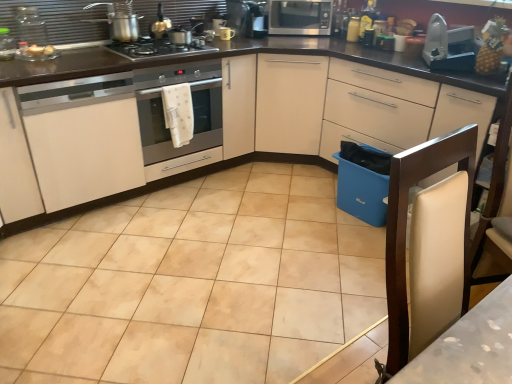
Question: Looking at the image, does beige ceramic tile at center seem bigger or smaller compared to metallic gray iron at upper right, which is the 1th appliance in right-to-left order?

Choices:
 (A) small
 (B) big

Answer: (B)

Question: Is point (330, 291) closer or farther from the camera than point (428, 56)?

Choices:
 (A) farther
 (B) closer

Answer: (B)

Question: Which of these objects is positioned closest to the white leather chair at right?

Choices:
 (A) satin silver microwave at upper center
 (B) metallic silver kettle at upper left, the 6th appliance in the right-to-left sequence
 (C) metallic gray iron at upper right, placed as the sixth appliance when sorted from left to right
 (D) yellow textured pineapple at upper right
 (E) stainless steel cooktop at upper center

Answer: (D)

Question: Which object is positioned closest to the white polka dot towel at center?

Choices:
 (A) satin silver microwave at upper center
 (B) metallic silver toaster at upper center, the 4th appliance viewed from the right
 (C) metallic silver coffee maker at upper center, the 4th appliance in the left-to-right sequence
 (D) yellow matte jar at upper right, which is the fifth appliance from left to right
 (E) matte white cabinet at center, the second cabinetry when ordered from left to right

Answer: (E)